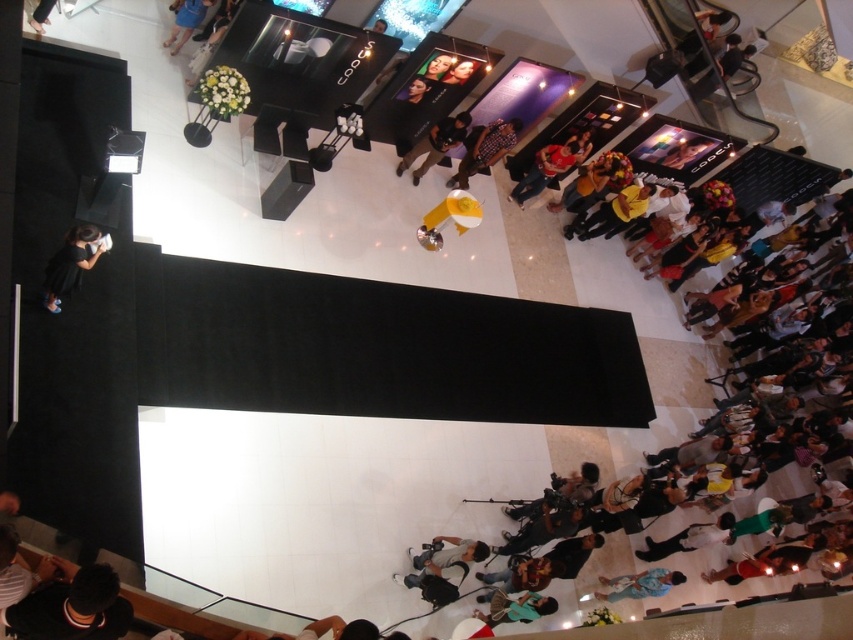
Measure the distance from black fuzzy hat at lower left to blue denim shorts at upper left.

black fuzzy hat at lower left is 26.32 feet from blue denim shorts at upper left.

Does point (62, 561) come farther from viewer compared to point (193, 28)?

No, it is in front of (193, 28).

The image size is (853, 640). Identify the location of black fuzzy hat at lower left. (71, 605).

Describe the element at coordinates (442, 557) in the screenshot. The image size is (853, 640). I see `dark gray backpack at lower center` at that location.

Between point (421, 572) and point (189, 32), which one is positioned in front?

Point (421, 572) is more forward.

The width and height of the screenshot is (853, 640). I want to click on dark gray backpack at lower center, so click(442, 557).

Describe the element at coordinates (442, 557) in the screenshot. I see `dark gray backpack at lower center` at that location.

Who is taller, dark gray backpack at lower center or red shirt at center?

Standing taller between the two is red shirt at center.

Which is behind, point (427, 552) or point (556, 163)?

The point (556, 163) is behind.

This screenshot has width=853, height=640. Find the location of `dark gray backpack at lower center`. dark gray backpack at lower center is located at coordinates (442, 557).